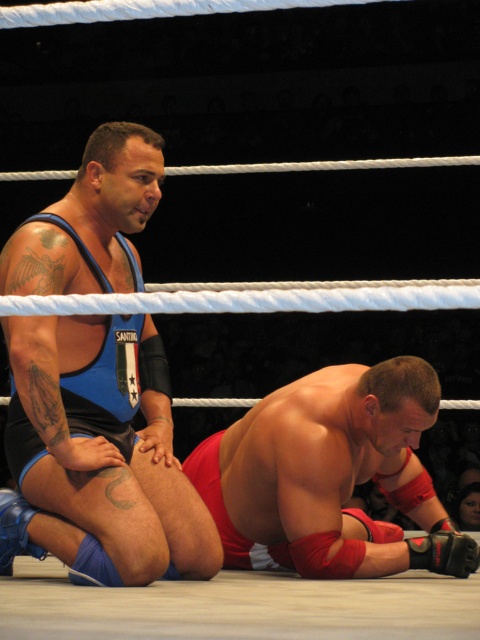
Question: Among these objects, which one is nearest to the camera?

Choices:
 (A) smooth red wrestling mat at lower center
 (B) blue fabric singlet at left

Answer: (B)

Question: Is blue fabric singlet at left smaller than smooth red wrestling mat at lower center?

Choices:
 (A) no
 (B) yes

Answer: (A)

Question: Does blue fabric singlet at left have a lesser width compared to smooth red wrestling mat at lower center?

Choices:
 (A) no
 (B) yes

Answer: (B)

Question: Is blue fabric singlet at left positioned at the back of smooth red wrestling mat at lower center?

Choices:
 (A) yes
 (B) no

Answer: (B)